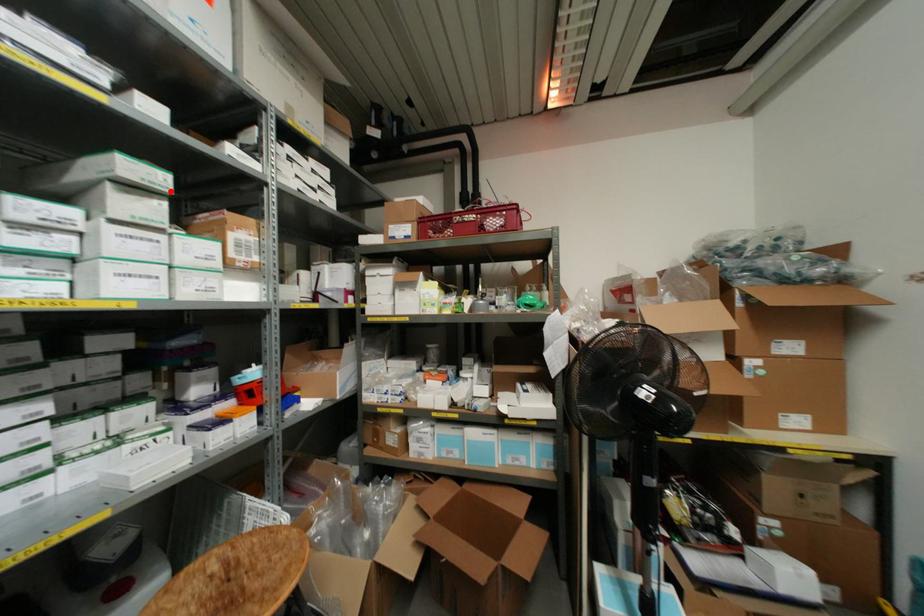
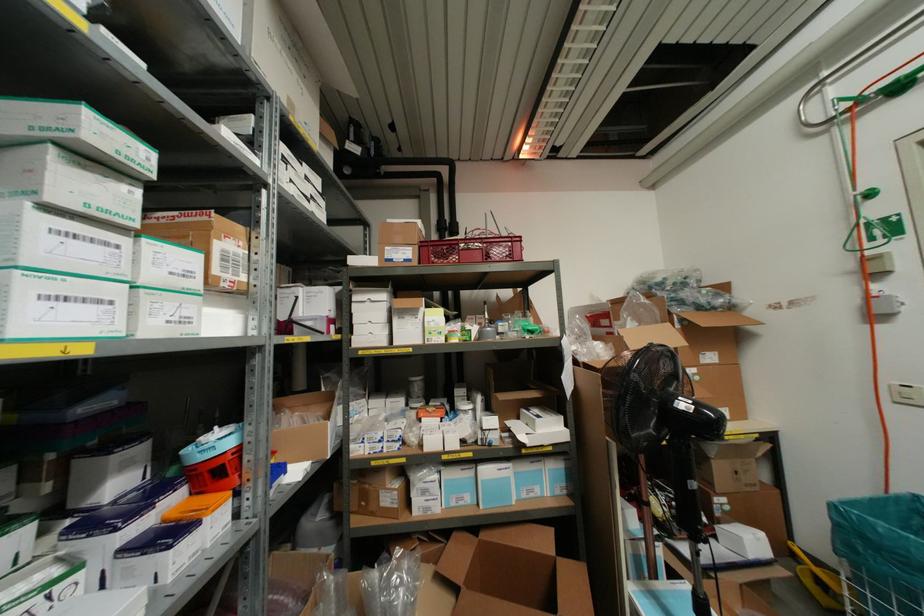
Where in the second image is the point corresponding to the highlighted location from the first image?

(152, 176)